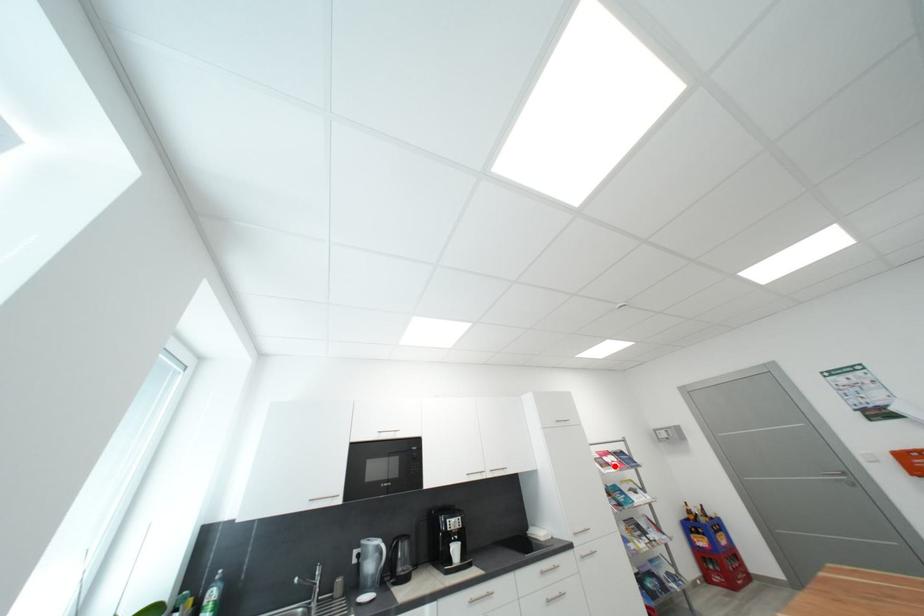
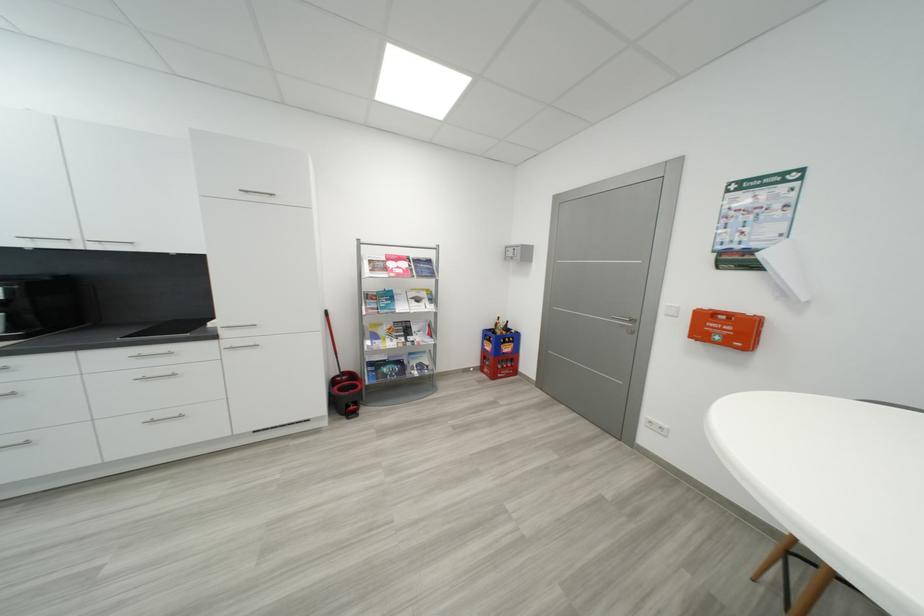
Question: I am providing you with two images of the same scene from different viewpoints. Image1 has a red point marked. In image2, the corresponding 3D location appears at what relative position? Reply with the corresponding letter.

Choices:
 (A) Closer
 (B) Farther

Answer: (A)